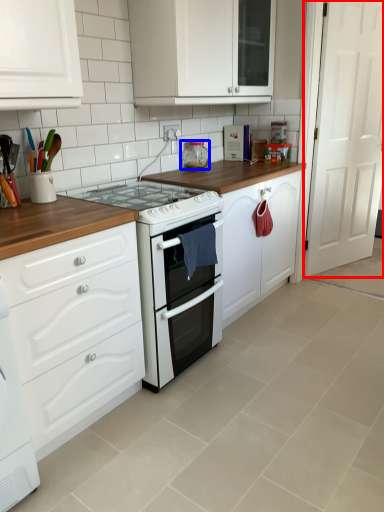
Question: Among these objects, which one is nearest to the camera, door (highlighted by a red box) or appliance (highlighted by a blue box)?

Choices:
 (A) door
 (B) appliance

Answer: (A)